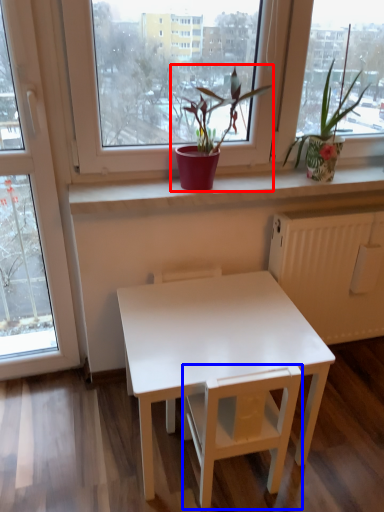
Question: Which of the following is the closest to the observer, houseplant (highlighted by a red box) or armchair (highlighted by a blue box)?

Choices:
 (A) houseplant
 (B) armchair

Answer: (B)